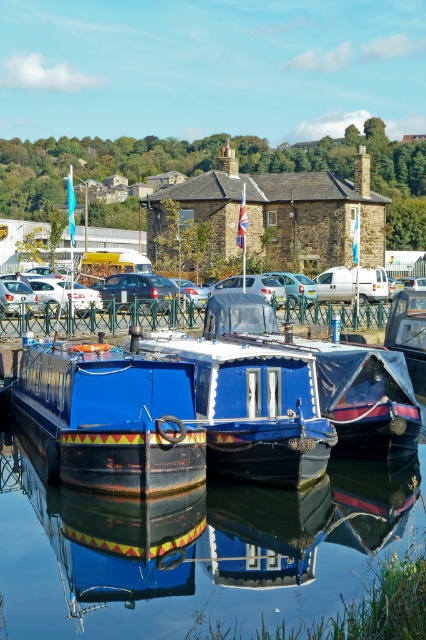
You are standing on the dock and see the smooth dark blue water at center and the shiny blue boat at center. Which object is positioned to the right of the other?

The smooth dark blue water at center is to the right of the shiny blue boat at center.